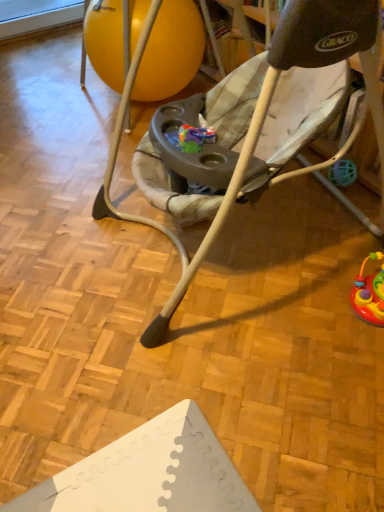
This screenshot has height=512, width=384. I want to click on rubberized yellow ball at center, so click(171, 52).

What do you see at coordinates (171, 52) in the screenshot?
I see `rubberized yellow ball at center` at bounding box center [171, 52].

This screenshot has height=512, width=384. Find the location of `gray fabric baby swing at center`. gray fabric baby swing at center is located at coordinates (266, 111).

Describe the element at coordinates (266, 111) in the screenshot. I see `gray fabric baby swing at center` at that location.

Locate an element on the screen. rubberized yellow ball at center is located at coordinates (171, 52).

Is rubberized yellow ball at center to the left of gray fabric baby swing at center from the viewer's perspective?

Yes.

Which object is more forward, rubberized yellow ball at center or gray fabric baby swing at center?

Positioned in front is gray fabric baby swing at center.

Between point (138, 13) and point (343, 47), which one is positioned behind?

The point (138, 13) is behind.

From the image's perspective, is rubberized yellow ball at center located above gray fabric baby swing at center?

Correct, rubberized yellow ball at center appears higher than gray fabric baby swing at center in the image.

From a real-world perspective, is rubberized yellow ball at center on top of gray fabric baby swing at center?

Actually, rubberized yellow ball at center is physically below gray fabric baby swing at center in the real world.

Does rubberized yellow ball at center have a greater width compared to gray fabric baby swing at center?

No, rubberized yellow ball at center is not wider than gray fabric baby swing at center.

In terms of height, does rubberized yellow ball at center look taller or shorter compared to gray fabric baby swing at center?

In the image, rubberized yellow ball at center appears to be shorter than gray fabric baby swing at center.

Is rubberized yellow ball at center smaller than gray fabric baby swing at center?

Yes.

Is rubberized yellow ball at center not inside gray fabric baby swing at center?

Yes, rubberized yellow ball at center is not within gray fabric baby swing at center.

Is rubberized yellow ball at center far from gray fabric baby swing at center?

Yes, rubberized yellow ball at center and gray fabric baby swing at center are quite far apart.

Could you tell me if rubberized yellow ball at center is facing gray fabric baby swing at center?

Yes, rubberized yellow ball at center faces towards gray fabric baby swing at center.

How many degrees apart are the facing directions of rubberized yellow ball at center and gray fabric baby swing at center?

rubberized yellow ball at center and gray fabric baby swing at center are facing 98.4 degrees away from each other.

What are the coordinates of `ball located behind the gray fabric baby swing at center` in the screenshot? It's located at (171, 52).

Looking at this image, is gray fabric baby swing at center to the right of rubberized yellow ball at center from the viewer's perspective?

Correct, you'll find gray fabric baby swing at center to the right of rubberized yellow ball at center.

Does gray fabric baby swing at center come in front of rubberized yellow ball at center?

That is True.

Is point (358, 21) behind point (169, 75)?

No, (358, 21) is closer to viewer.

From the image's perspective, which one is positioned higher, gray fabric baby swing at center or rubberized yellow ball at center?

rubberized yellow ball at center, from the image's perspective.

From a real-world perspective, is gray fabric baby swing at center under rubberized yellow ball at center?

Incorrect, from a real-world perspective, gray fabric baby swing at center is higher than rubberized yellow ball at center.

Is gray fabric baby swing at center thinner than rubberized yellow ball at center?

In fact, gray fabric baby swing at center might be wider than rubberized yellow ball at center.

From the picture: In terms of height, does gray fabric baby swing at center look taller or shorter compared to rubberized yellow ball at center?

gray fabric baby swing at center is taller than rubberized yellow ball at center.

Does gray fabric baby swing at center have a larger size compared to rubberized yellow ball at center?

Yes, gray fabric baby swing at center is bigger than rubberized yellow ball at center.

Is gray fabric baby swing at center outside of rubberized yellow ball at center?

Yes, gray fabric baby swing at center is outside of rubberized yellow ball at center.

Are gray fabric baby swing at center and rubberized yellow ball at center located far from each other?

Absolutely, gray fabric baby swing at center is distant from rubberized yellow ball at center.

Is gray fabric baby swing at center oriented away from rubberized yellow ball at center?

gray fabric baby swing at center is not turned away from rubberized yellow ball at center.

How many degrees apart are the facing directions of gray fabric baby swing at center and rubberized yellow ball at center?

The facing directions of gray fabric baby swing at center and rubberized yellow ball at center are 98.4 degrees apart.

The height and width of the screenshot is (512, 384). I want to click on chair lying on the right of rubberized yellow ball at center, so click(x=266, y=111).

The image size is (384, 512). In order to click on chair in front of the rubberized yellow ball at center in this screenshot , I will do `click(266, 111)`.

I want to click on ball below the gray fabric baby swing at center (from a real-world perspective), so click(171, 52).